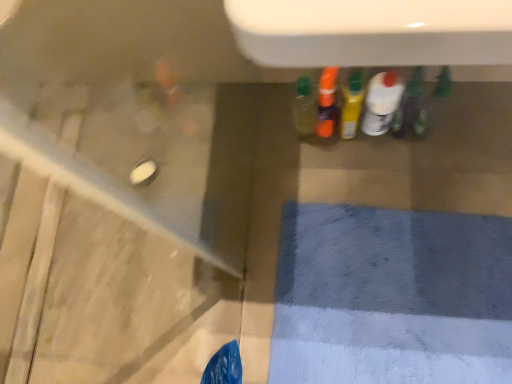
Locate an element on the screen. This screenshot has width=512, height=384. free point in front of translucent orange bottle at center, the fourth bottle positioned from the right is located at coordinates (356, 167).